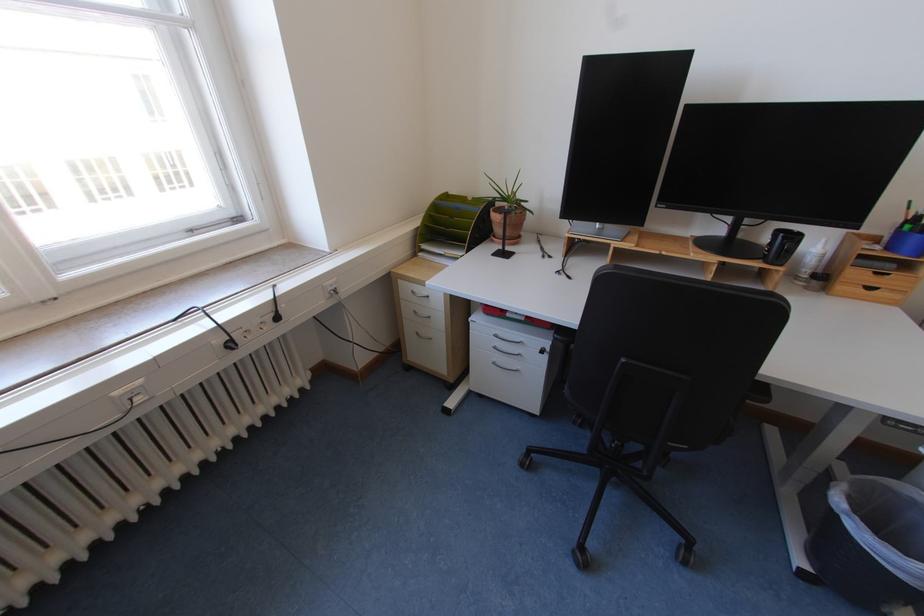
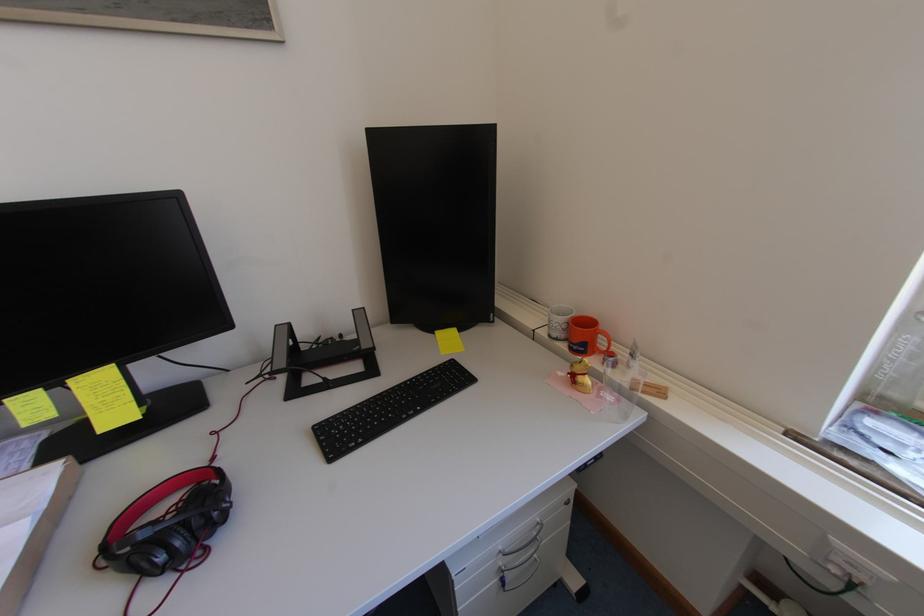
Based on the photo, the first image is from the beginning of the video and the second image is from the end. How did the camera likely rotate when shooting the video?

The camera rotated toward left-down.